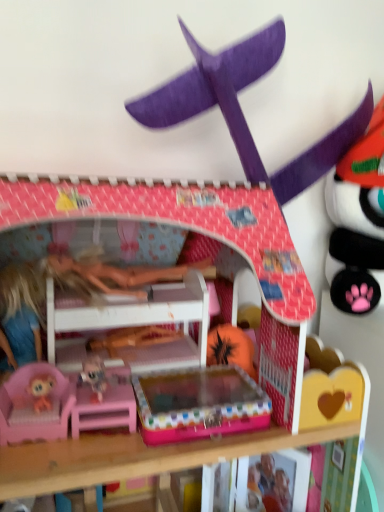
Question: Should I look upward or downward to see purple cardboard airplane at upper center?

Choices:
 (A) down
 (B) up

Answer: (B)

Question: Considering the relative sizes of purple cardboard airplane at upper center and pink plastic bunk bed at center in the image provided, is purple cardboard airplane at upper center thinner than pink plastic bunk bed at center?

Choices:
 (A) no
 (B) yes

Answer: (B)

Question: Is purple cardboard airplane at upper center located outside pink plastic bunk bed at center?

Choices:
 (A) yes
 (B) no

Answer: (A)

Question: Is the depth of purple cardboard airplane at upper center less than that of pink plastic bunk bed at center?

Choices:
 (A) no
 (B) yes

Answer: (A)

Question: From a real-world perspective, is purple cardboard airplane at upper center beneath pink plastic bunk bed at center?

Choices:
 (A) yes
 (B) no

Answer: (B)

Question: Is purple cardboard airplane at upper center touching pink plastic bunk bed at center?

Choices:
 (A) yes
 (B) no

Answer: (B)

Question: Is purple cardboard airplane at upper center at the left side of pink plastic bunk bed at center?

Choices:
 (A) yes
 (B) no

Answer: (B)

Question: Could you tell me if pink plastic bunk bed at center is turned towards purple cardboard airplane at upper center?

Choices:
 (A) no
 (B) yes

Answer: (A)

Question: Is pink plastic bunk bed at center outside purple cardboard airplane at upper center?

Choices:
 (A) yes
 (B) no

Answer: (A)

Question: Is purple cardboard airplane at upper center located within pink plastic bunk bed at center?

Choices:
 (A) yes
 (B) no

Answer: (B)

Question: Are pink plastic bunk bed at center and purple cardboard airplane at upper center beside each other?

Choices:
 (A) yes
 (B) no

Answer: (B)

Question: Is the position of pink plastic bunk bed at center more distant than that of purple cardboard airplane at upper center?

Choices:
 (A) no
 (B) yes

Answer: (A)

Question: From the image's perspective, does pink plastic bunk bed at center appear higher than purple cardboard airplane at upper center?

Choices:
 (A) yes
 (B) no

Answer: (B)

Question: In the image, is pink plastic bunk bed at center on the left side or the right side of purple cardboard airplane at upper center?

Choices:
 (A) left
 (B) right

Answer: (A)